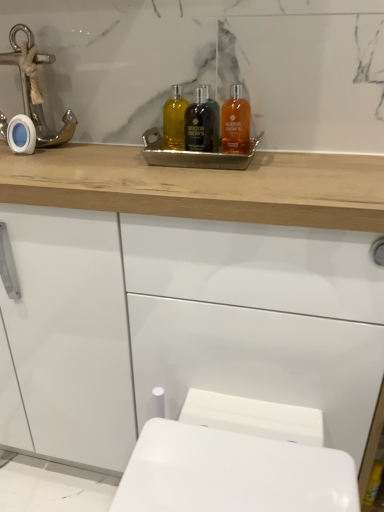
This screenshot has width=384, height=512. Identify the location of free space that is to the left of metallic tray at center. (105, 157).